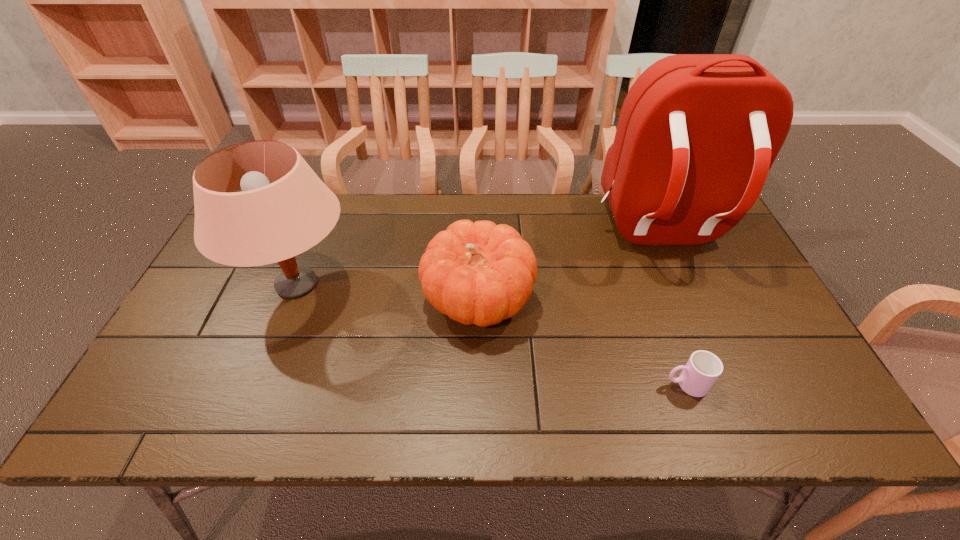
Where is `vacant space located 0.110m with the handle on the side of the nearest object`? vacant space located 0.110m with the handle on the side of the nearest object is located at coordinates (616, 384).

This screenshot has width=960, height=540. Identify the location of free space located with the handle on the side of the nearest object. (634, 384).

Identify the location of blank space located 0.270m with the handle on the side of the nearest object. This screenshot has width=960, height=540. (545, 384).

Image resolution: width=960 pixels, height=540 pixels. In order to click on object present at the far edge in this screenshot , I will do `click(697, 135)`.

Where is `object that is at the near edge`? object that is at the near edge is located at coordinates (703, 368).

The height and width of the screenshot is (540, 960). Identify the location of object that is at the left edge. (266, 223).

You are a GUI agent. You are given a task and a screenshot of the screen. Output one action in this format:
    pyautogui.click(x=<x>, y=<y>)
    Task: Click on the object that is at the right edge
    
    Given the screenshot: What is the action you would take?
    pyautogui.click(x=697, y=135)

Where is `object at the far right corner`? Image resolution: width=960 pixels, height=540 pixels. object at the far right corner is located at coordinates (697, 135).

The height and width of the screenshot is (540, 960). In order to click on vacant space at the far edge of the desktop in this screenshot , I will do `click(531, 203)`.

At what (x,y) coordinates should I click in order to perform the action: click on free spot at the near edge of the desktop. Please return your answer as a coordinate pair (x, y). The image size is (960, 540). Looking at the image, I should click on (433, 403).